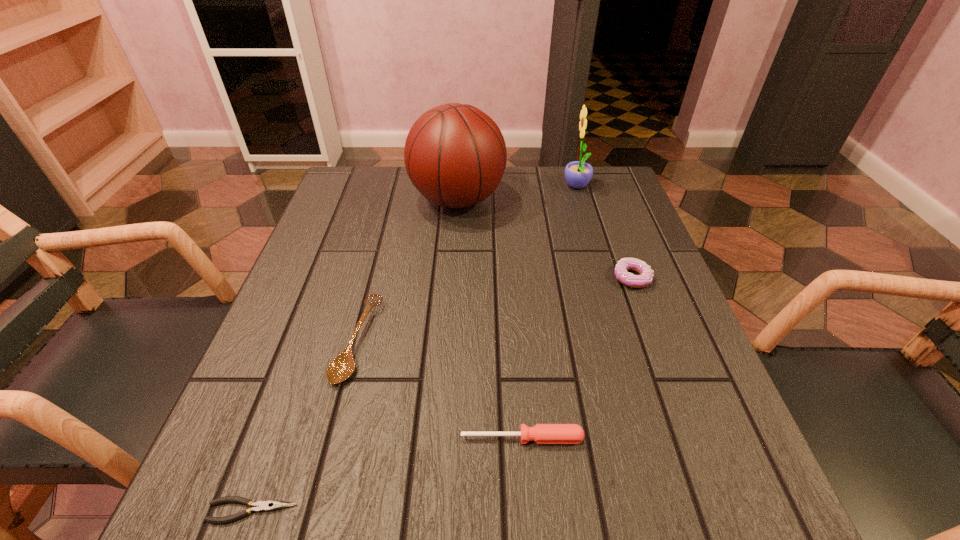
Identify the location of pliers positioned at the left edge. (270, 505).

In order to click on sunflower that is at the right edge in this screenshot , I will do `click(578, 174)`.

The width and height of the screenshot is (960, 540). I want to click on doughnut situated at the right edge, so click(645, 278).

Locate an element on the screen. object positioned at the near left corner is located at coordinates (270, 505).

Locate an element on the screen. object that is at the far right corner is located at coordinates (578, 174).

Locate an element on the screen. This screenshot has width=960, height=540. free space at the far edge of the desktop is located at coordinates (409, 179).

The height and width of the screenshot is (540, 960). I want to click on vacant space at the near edge of the desktop, so click(365, 495).

Identify the location of free space at the left edge of the desktop. (304, 336).

In order to click on vacant area at the right edge in this screenshot , I will do `click(596, 264)`.

Locate an element on the screen. This screenshot has width=960, height=540. vacant space at the far right corner of the desktop is located at coordinates (597, 190).